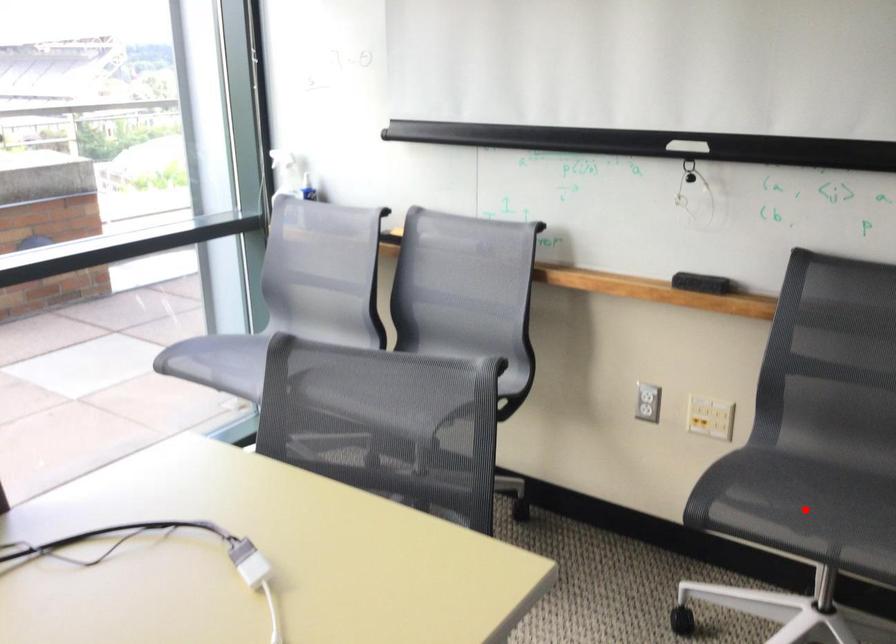
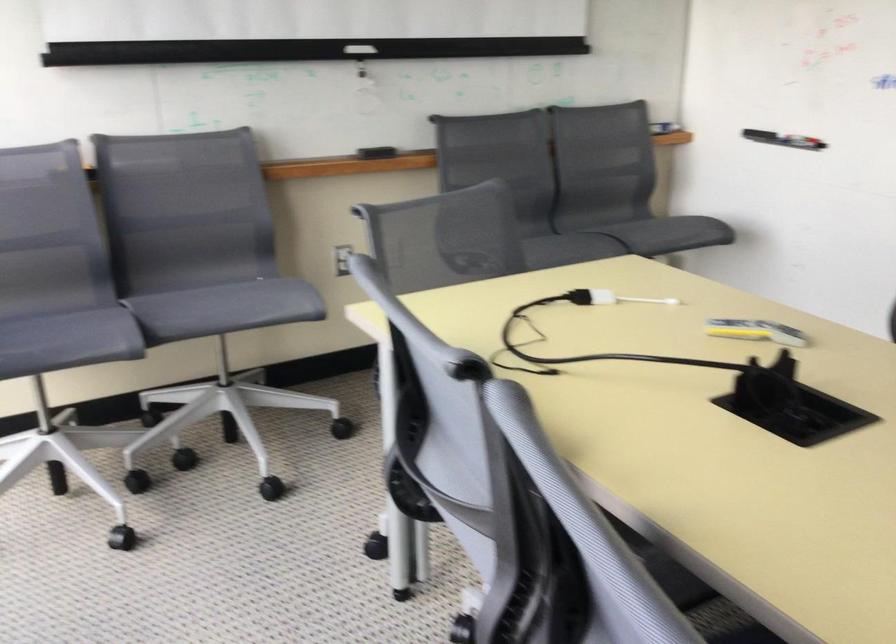
Question: A red point is marked in image1. In image2, is the corresponding 3D point closer to the camera or farther? Reply with the corresponding letter.

Choices:
 (A) The corresponding 3D point is closer.
 (B) The corresponding 3D point is farther.

Answer: (B)